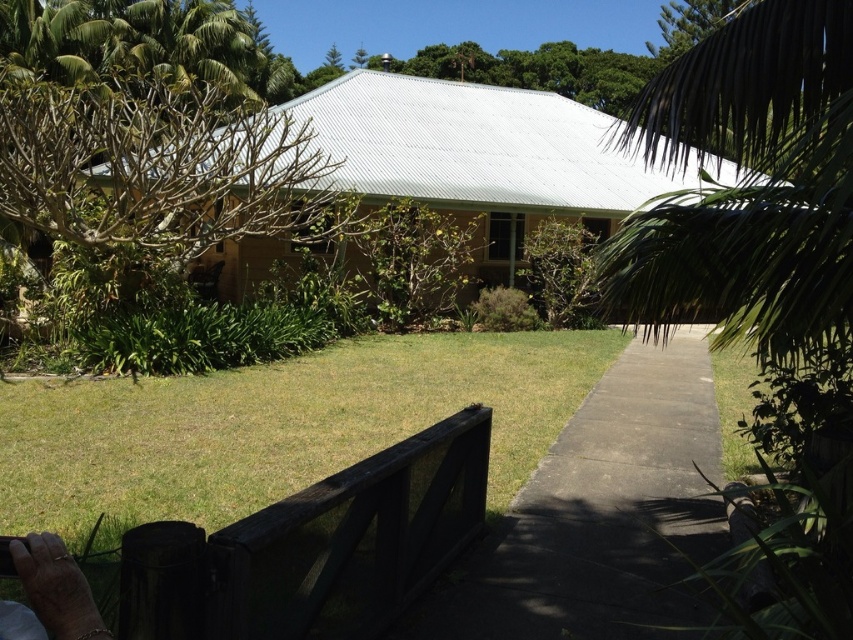
You are a gardener who wants to mow the lawn. You see the green grass at center and the concrete at center. Which one should you mow?

The green grass at center should be mowed because concrete at center is an inorganic material and does not require mowing.

You are standing at the edge of the lawn and want to walk to the wooden railing in the foreground. According to the image coordinates, where is the green grass at center located?

The green grass at center is located at coordinates point (277, 426).

You are standing at the entrance of the house and want to walk to the point marked as point (277,426). Which direction should you head to reach it?

The point (277,426) is on green grass at center, so you should walk towards the center of the green grass area to reach it.